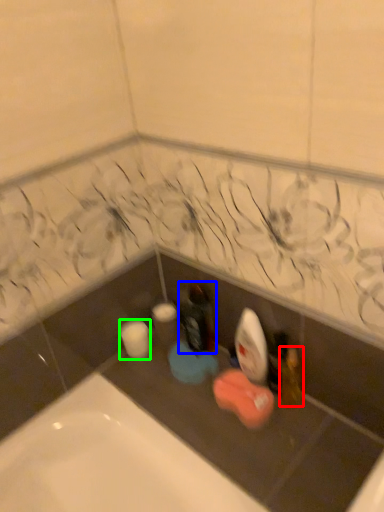
Question: Which is farther away from toiletry (highlighted by a red box)? bottle (highlighted by a blue box) or toilet paper (highlighted by a green box)?

Choices:
 (A) bottle
 (B) toilet paper

Answer: (B)